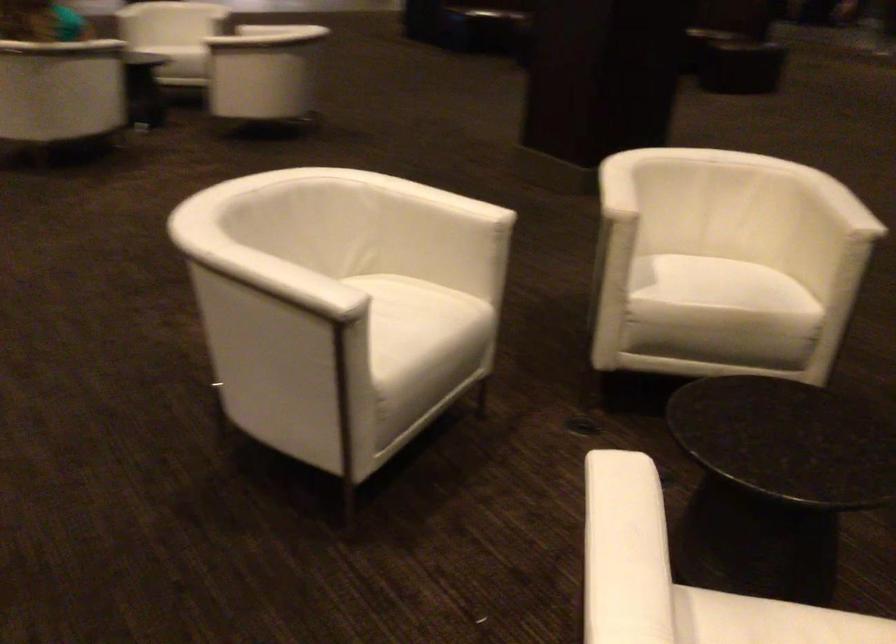
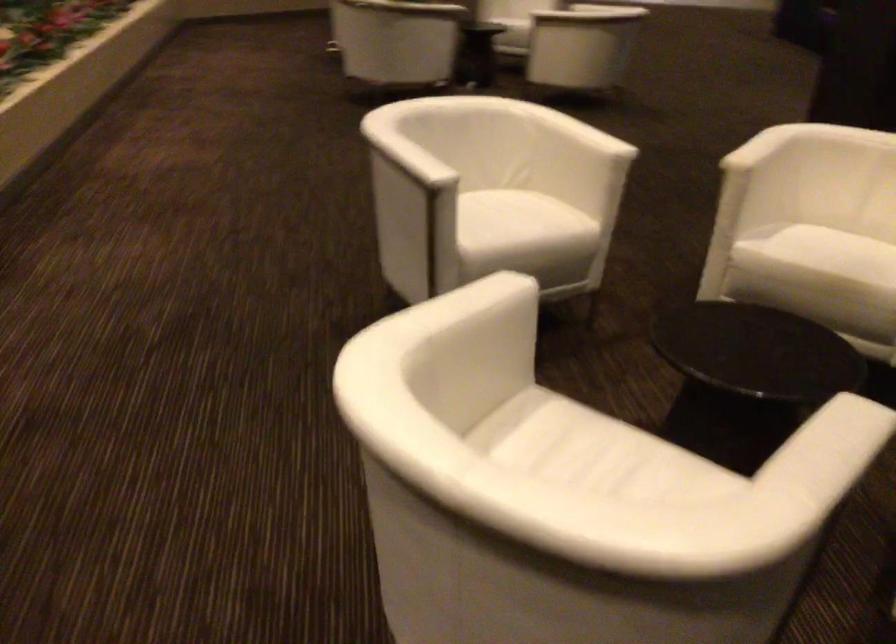
Locate, in the second image, the point that corresponds to [279,279] in the first image.

(406, 158)